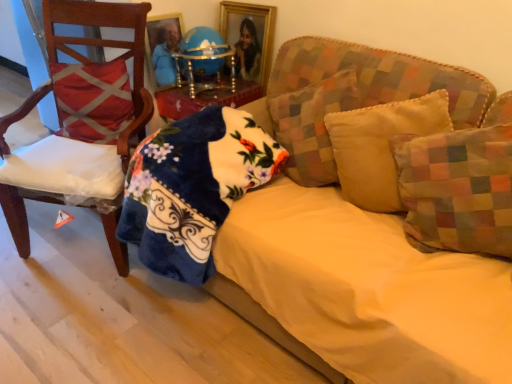
Where is `free space above gold/glass picture frame at upper center (from a real-world perspective)`? This screenshot has height=384, width=512. free space above gold/glass picture frame at upper center (from a real-world perspective) is located at coordinates (246, 1).